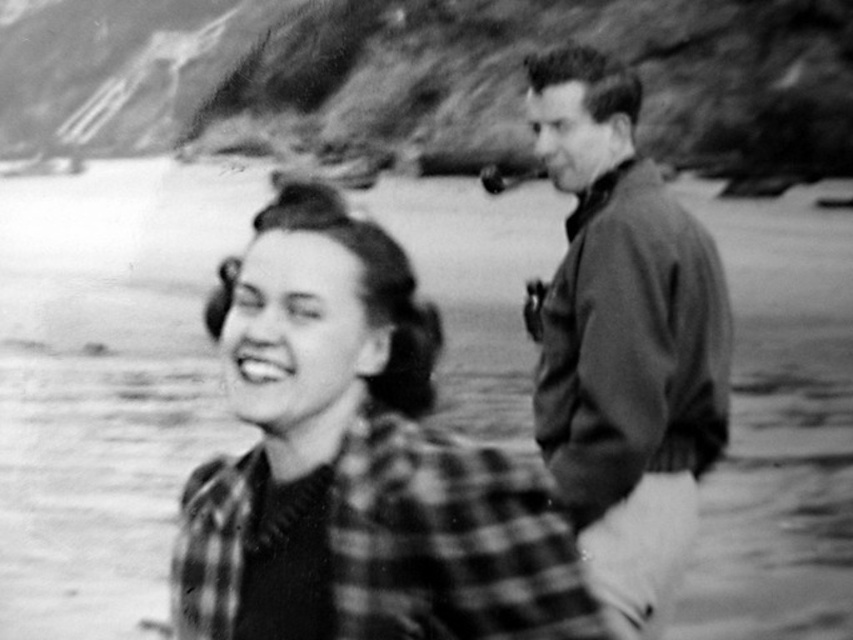
Who is shorter, plaid fabric shirt at center or dark brown leather jacket at right?

plaid fabric shirt at center is shorter.

Can you confirm if plaid fabric shirt at center is wider than dark brown leather jacket at right?

Correct, the width of plaid fabric shirt at center exceeds that of dark brown leather jacket at right.

You are a GUI agent. You are given a task and a screenshot of the screen. Output one action in this format:
    pyautogui.click(x=<x>, y=<y>)
    Task: Click on the plaid fabric shirt at center
    The image size is (853, 640).
    Given the screenshot: What is the action you would take?
    pyautogui.click(x=357, y=465)

Identify the location of plaid fabric shirt at center. This screenshot has width=853, height=640. (357, 465).